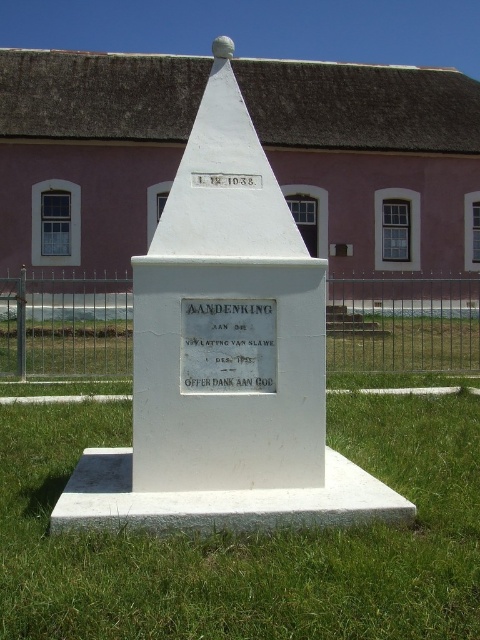
Question: Is green grass at center positioned at the back of white marble monument at center?

Choices:
 (A) yes
 (B) no

Answer: (B)

Question: Which of the following is the farthest from the observer?

Choices:
 (A) (268, 305)
 (B) (180, 445)
 (C) (172, 593)
 (D) (432, 326)

Answer: (D)

Question: Which point is closer to the camera?

Choices:
 (A) (178, 285)
 (B) (1, 348)

Answer: (A)

Question: Is green grass at center below white polished stone plaque at center?

Choices:
 (A) yes
 (B) no

Answer: (A)

Question: Can you confirm if green grass at center is positioned to the left of metallic wire fence at center?

Choices:
 (A) yes
 (B) no

Answer: (B)

Question: Which object is closer to the camera taking this photo?

Choices:
 (A) green grass at center
 (B) white marble monument at center
 (C) white polished stone plaque at center

Answer: (A)